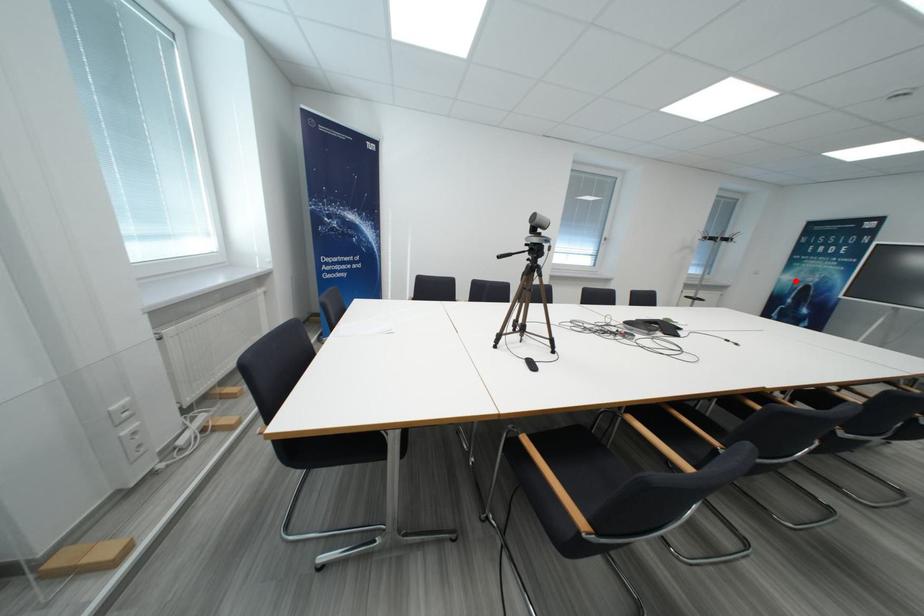
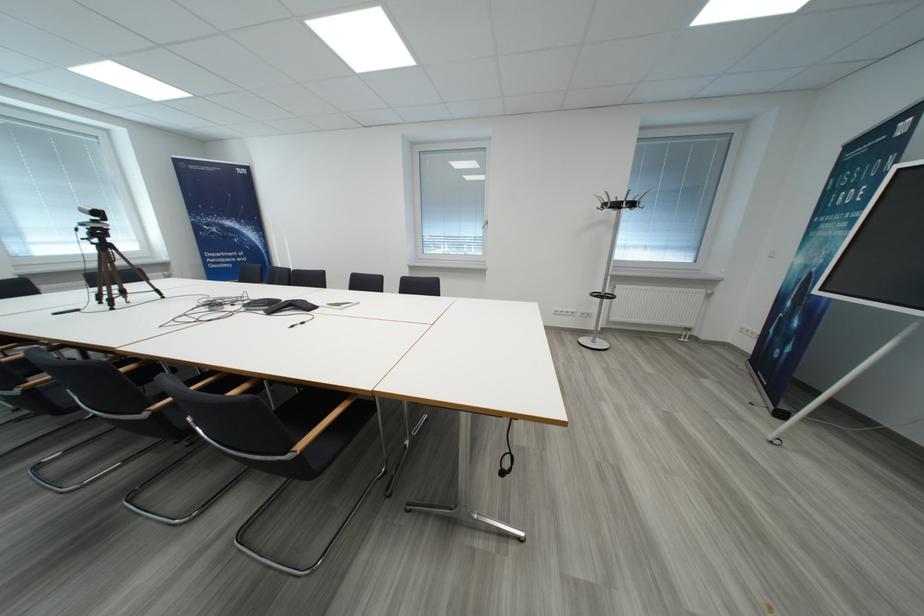
Locate, in the second image, the point that corresponds to the highlighted location in the first image.

(807, 264)